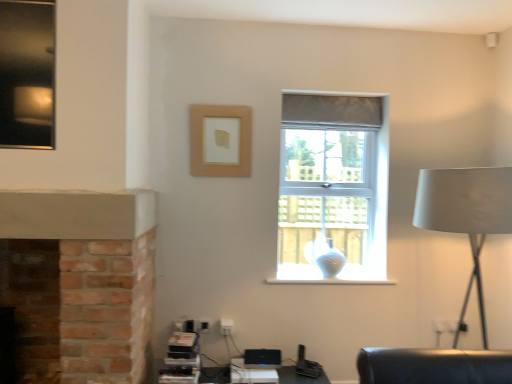
The image size is (512, 384). I want to click on beige matte picture frame at upper center, so click(x=220, y=140).

Where is `white matte table lamp at right`? white matte table lamp at right is located at coordinates (466, 214).

You are a GUI agent. You are given a task and a screenshot of the screen. Output one action in this format:
    pyautogui.click(x=<x>, y=<y>)
    Task: Click on the translucent glass vase at window
    Image resolution: width=512 pixels, height=384 pixels.
    Given the screenshot: What is the action you would take?
    pyautogui.click(x=331, y=261)

I want to click on clear glass window at center, so click(333, 186).

Based on their positions, is beige matte picture frame at upper center located to the left or right of translucent glass vase at window?

In the image, beige matte picture frame at upper center appears on the left side of translucent glass vase at window.

Which is less distant, (222, 115) or (329, 251)?

Point (222, 115)

Find the location of a particular element. This screenshot has width=512, height=384. picture frame positioned vertically above the translucent glass vase at window (from a real-world perspective) is located at coordinates (220, 140).

From the image's perspective, is beige matte picture frame at upper center under translucent glass vase at window?

No.

Is white plastic table at lower center aimed at translucent glass vase at window?

No, white plastic table at lower center is not aimed at translucent glass vase at window.

Measure the distance between white plastic table at lower center and translucent glass vase at window.

The distance of white plastic table at lower center from translucent glass vase at window is 26.98 inches.

Is white plastic table at lower center directly adjacent to translucent glass vase at window?

No.

How different are the orientations of white plastic table at lower center and translucent glass vase at window in degrees?

The facing directions of white plastic table at lower center and translucent glass vase at window are 0.000354 degrees apart.

Looking at their sizes, would you say translucent glass vase at window is wider or thinner than clear glass window at center?

Considering their sizes, translucent glass vase at window looks slimmer than clear glass window at center.

Is translucent glass vase at window far from clear glass window at center?

Yes.

From the picture: Is translucent glass vase at window to the right of clear glass window at center from the viewer's perspective?

Incorrect, translucent glass vase at window is not on the right side of clear glass window at center.

From a real-world perspective, which object rests below the other?

translucent glass vase at window is physically lower.

Between beige matte picture frame at upper center and white plastic table at lower center, which one appears on the left side from the viewer's perspective?

beige matte picture frame at upper center is more to the left.

From the image's perspective, relative to white plastic table at lower center, is beige matte picture frame at upper center above or below?

beige matte picture frame at upper center is situated higher than white plastic table at lower center in the image.

Is beige matte picture frame at upper center smaller than white plastic table at lower center?

Indeed, beige matte picture frame at upper center has a smaller size compared to white plastic table at lower center.

Is beige matte picture frame at upper center spatially inside white plastic table at lower center, or outside of it?

beige matte picture frame at upper center cannot be found inside white plastic table at lower center.

From a real-world perspective, which object rests below the other?

translucent glass vase at window, from a real-world perspective.

Can you confirm if white matte table lamp at right is positioned to the right of translucent glass vase at window?

Yes, white matte table lamp at right is to the right of translucent glass vase at window.

Considering the points (432, 191) and (320, 259), which point is behind, point (432, 191) or point (320, 259)?

Positioned behind is point (320, 259).

Measure the distance from white matte table lamp at right to translucent glass vase at window.

white matte table lamp at right is 39.22 inches away from translucent glass vase at window.

Can you confirm if translucent glass vase at window is smaller than beige matte picture frame at upper center?

No, translucent glass vase at window is not smaller than beige matte picture frame at upper center.

In the scene shown: Considering their positions, is translucent glass vase at window located in front of or behind beige matte picture frame at upper center?

translucent glass vase at window is behind beige matte picture frame at upper center.

Where is `picture frame that is above the translucent glass vase at window (from a real-world perspective)`? Image resolution: width=512 pixels, height=384 pixels. picture frame that is above the translucent glass vase at window (from a real-world perspective) is located at coordinates (220, 140).

From a real-world perspective, relative to beige matte picture frame at upper center, is translucent glass vase at window vertically above or below?

In terms of real-world spatial position, translucent glass vase at window is below beige matte picture frame at upper center.

Consider the image. Considering the positions of objects white plastic table at lower center and beige matte picture frame at upper center in the image provided, who is more to the left, white plastic table at lower center or beige matte picture frame at upper center?

Positioned to the left is beige matte picture frame at upper center.

Considering the sizes of objects white plastic table at lower center and beige matte picture frame at upper center in the image provided, who is wider, white plastic table at lower center or beige matte picture frame at upper center?

Wider between the two is white plastic table at lower center.

From the image's perspective, is white plastic table at lower center below beige matte picture frame at upper center?

Correct, white plastic table at lower center appears lower than beige matte picture frame at upper center in the image.

Based on the photo, can beige matte picture frame at upper center be found inside white plastic table at lower center?

No, beige matte picture frame at upper center is not a part of white plastic table at lower center.

Locate an element on the screen. Image resolution: width=512 pixels, height=384 pixels. glass vase below the beige matte picture frame at upper center (from a real-world perspective) is located at coordinates (331, 261).

In order to click on glass vase located on the right of white plastic table at lower center in this screenshot , I will do `click(331, 261)`.

Looking at the image, which one is located further to beige matte picture frame at upper center, translucent glass vase at window or white plastic table at lower center?

white plastic table at lower center.

Considering their positions, is white matte table lamp at right positioned closer to beige matte picture frame at upper center than translucent glass vase at window?

The object closer to beige matte picture frame at upper center is translucent glass vase at window.

When comparing their distances from beige matte picture frame at upper center, does translucent glass vase at window or clear glass window at center seem closer?

The object closer to beige matte picture frame at upper center is translucent glass vase at window.

Based on their spatial positions, is translucent glass vase at window or beige matte picture frame at upper center further from clear glass window at center?

beige matte picture frame at upper center.

When comparing their distances from white plastic table at lower center, does white matte table lamp at right or beige matte picture frame at upper center seem closer?

The object closer to white plastic table at lower center is white matte table lamp at right.

From the image, which object appears to be farther from white plastic table at lower center, white matte table lamp at right or translucent glass vase at window?

white matte table lamp at right is further to white plastic table at lower center.

Looking at the image, which one is located further to white plastic table at lower center, beige matte picture frame at upper center or white matte table lamp at right?

beige matte picture frame at upper center is positioned further to the anchor white plastic table at lower center.

From the image, which object appears to be nearer to translucent glass vase at window, white matte table lamp at right or beige matte picture frame at upper center?

white matte table lamp at right is positioned closer to the anchor translucent glass vase at window.

Locate an element on the screen. window between beige matte picture frame at upper center and white matte table lamp at right is located at coordinates (333, 186).

At what (x,y) coordinates should I click in order to perform the action: click on window between beige matte picture frame at upper center and white plastic table at lower center in the vertical direction. Please return your answer as a coordinate pair (x, y). Looking at the image, I should click on (333, 186).

Locate an element on the screen. table lamp between beige matte picture frame at upper center and white plastic table at lower center in the vertical direction is located at coordinates coord(466,214).

You are a GUI agent. You are given a task and a screenshot of the screen. Output one action in this format:
    pyautogui.click(x=<x>, y=<y>)
    Task: Click on the glass vase between beige matte picture frame at upper center and white plastic table at lower center vertically
    The height and width of the screenshot is (384, 512).
    Given the screenshot: What is the action you would take?
    pyautogui.click(x=331, y=261)